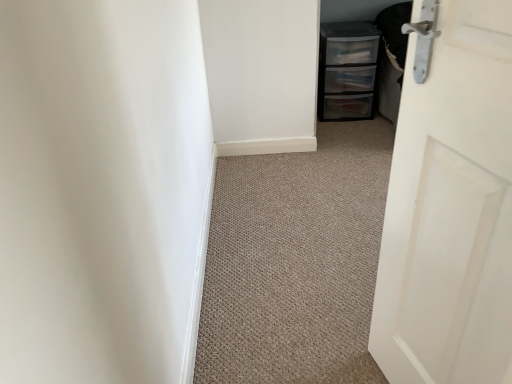
Where is `clear plastic drawers at upper right`? clear plastic drawers at upper right is located at coordinates (347, 70).

Describe the element at coordinates (347, 70) in the screenshot. I see `clear plastic drawers at upper right` at that location.

Identify the location of clear plastic drawers at upper right. This screenshot has height=384, width=512. click(x=347, y=70).